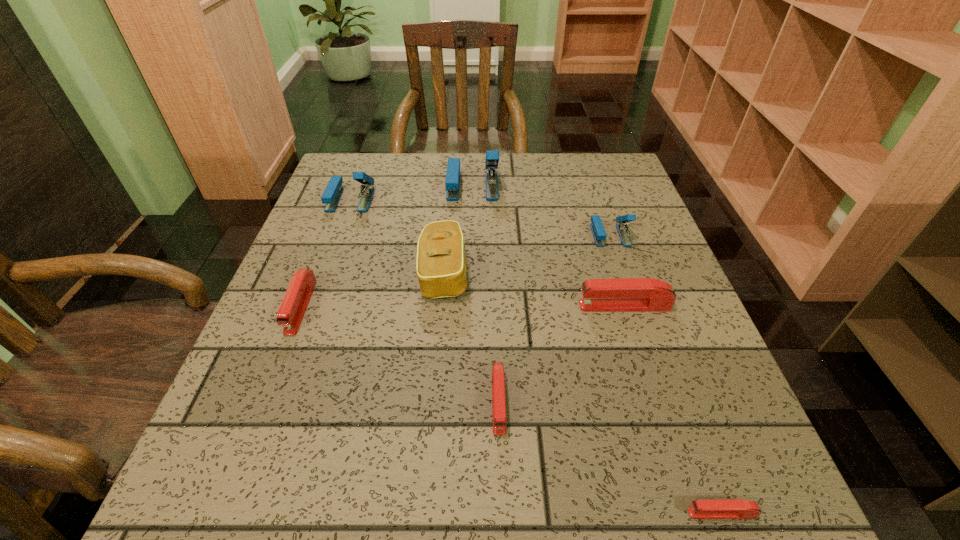
The height and width of the screenshot is (540, 960). I want to click on the second red stapler from left to right, so click(x=498, y=382).

At what (x,y) coordinates should I click in order to perform the action: click on the second nearest red stapler. Please return your answer as a coordinate pair (x, y). Looking at the image, I should click on (498, 382).

Identify the location of the nearest stapler. (734, 508).

The width and height of the screenshot is (960, 540). Identify the location of the shortest object. (734, 508).

Find the location of `free space located 0.360m on the front of the biggest blue stapler`. free space located 0.360m on the front of the biggest blue stapler is located at coordinates (470, 305).

What are the coordinates of `vacant region located on the back of the leftmost blue stapler` in the screenshot? It's located at (367, 156).

You are a GUI agent. You are given a task and a screenshot of the screen. Output one action in this format:
    pyautogui.click(x=<x>, y=<y>)
    Task: Click on the free spot located on the zipper side of the brown clutch bag
    The height and width of the screenshot is (540, 960).
    Given the screenshot: What is the action you would take?
    pyautogui.click(x=580, y=273)

The height and width of the screenshot is (540, 960). I want to click on vacant space located on the back of the third farthest stapler, so click(x=586, y=163).

You are a GUI agent. You are given a task and a screenshot of the screen. Output one action in this format:
    pyautogui.click(x=<x>, y=<y>)
    Task: Click on the free space located 0.080m on the front-facing side of the biggest red stapler
    This screenshot has width=960, height=540.
    Given the screenshot: What is the action you would take?
    pyautogui.click(x=539, y=306)

Locate an element on the screen. vacant area situated on the front-facing side of the biggest red stapler is located at coordinates [493, 306].